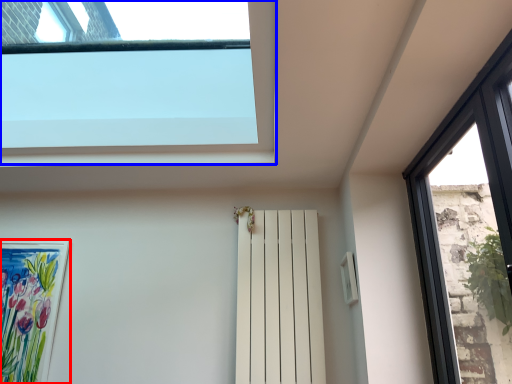
Question: Which of the following is the farthest to the observer, picture frame (highlighted by a red box) or window (highlighted by a blue box)?

Choices:
 (A) picture frame
 (B) window

Answer: (A)